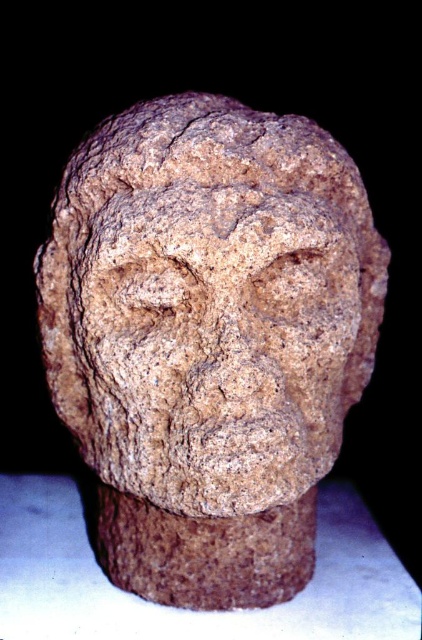
You are an archaeologist examining the stone sculpture. You notice a specific point at coordinates (208, 339). Based on the description, what object does this point most likely belong to?

The point at coordinates (208, 339) corresponds to the brown rough stone head at center.

You are an archaeologist examining the stone sculpture. You notice two parts of the sculpture labeled as the brown rough stone head at center and the rough stone face at center. Since they are very close, can you determine if they are actually the same part or separate parts of the sculpture?

The distance between the brown rough stone head at center and the rough stone face at center is only 0.98 inches, which suggests they are likely separate parts of the sculpture but positioned very close together.

You are an art conservator examining the stone sculpture. You notice two points on the sculpture marked as point 1 at coordinates point (x=316, y=346) and point 2 at coordinates point (x=89, y=371). Which point is nearer to your viewpoint as you look at the sculpture?

Point (x=316, y=346) is closer to the camera than point (x=89, y=371), so the point 1 at coordinates point (x=316, y=346) is nearer to your viewpoint.